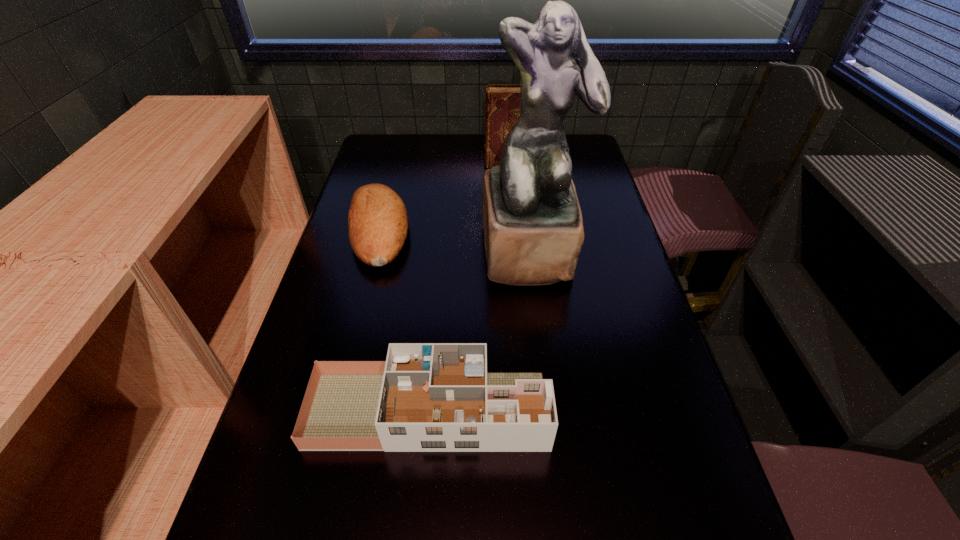
At what (x,y) coordinates should I click in order to perform the action: click on the tallest object. Please return your answer as a coordinate pair (x, y). This screenshot has width=960, height=540. Looking at the image, I should click on (x=533, y=228).

This screenshot has width=960, height=540. What are the coordinates of `hardback book` in the screenshot? It's located at (503, 107).

Where is `the second tallest object`? The width and height of the screenshot is (960, 540). the second tallest object is located at coordinates (503, 107).

Find the location of a particular element. The image size is (960, 540). the nearest object is located at coordinates (426, 397).

Where is `bread`? The height and width of the screenshot is (540, 960). bread is located at coordinates (377, 220).

Identify the location of blank space located in a relaxed pose on the sculpture. (539, 320).

Where is `vacant space situated 0.120m on the spine side of the farthest object`? The width and height of the screenshot is (960, 540). vacant space situated 0.120m on the spine side of the farthest object is located at coordinates (450, 164).

This screenshot has height=540, width=960. What are the coordinates of `vacant space located on the spine side of the farthest object` in the screenshot? It's located at (430, 164).

You are a GUI agent. You are given a task and a screenshot of the screen. Output one action in this format:
    pyautogui.click(x=<x>, y=<y>)
    Task: Click on the vacant space located on the spine side of the farthest object
    Image resolution: width=960 pixels, height=540 pixels.
    Given the screenshot: What is the action you would take?
    pyautogui.click(x=382, y=164)

This screenshot has width=960, height=540. Find the location of `free space located 0.220m at the front door of the nearest object`. free space located 0.220m at the front door of the nearest object is located at coordinates (656, 410).